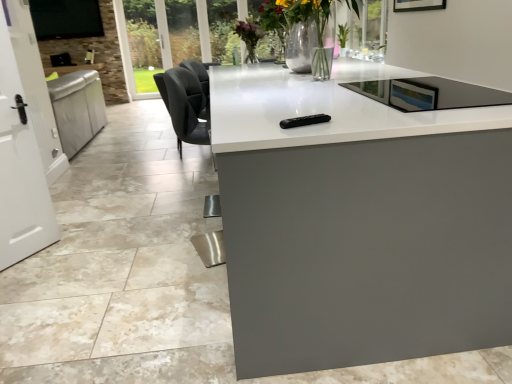
Question: Can you confirm if black glass tv at upper left is thinner than white glossy door at left?

Choices:
 (A) no
 (B) yes

Answer: (A)

Question: From a real-world perspective, is black glass tv at upper left positioned under white glossy door at left based on gravity?

Choices:
 (A) yes
 (B) no

Answer: (B)

Question: Is black glass tv at upper left closer to the viewer compared to white glossy door at left?

Choices:
 (A) no
 (B) yes

Answer: (A)

Question: Does black glass tv at upper left appear on the right side of white glossy door at left?

Choices:
 (A) no
 (B) yes

Answer: (A)

Question: Considering the relative sizes of black glass tv at upper left and white glossy door at left in the image provided, is black glass tv at upper left smaller than white glossy door at left?

Choices:
 (A) no
 (B) yes

Answer: (A)

Question: Choose the correct answer: Is white glossy countertop at center inside black glass tv at upper left or outside it?

Choices:
 (A) inside
 (B) outside

Answer: (B)

Question: From the image's perspective, is white glossy countertop at center above or below black glass tv at upper left?

Choices:
 (A) above
 (B) below

Answer: (B)

Question: In terms of height, does white glossy countertop at center look taller or shorter compared to black glass tv at upper left?

Choices:
 (A) short
 (B) tall

Answer: (A)

Question: Considering the relative positions of white glossy countertop at center and black glass tv at upper left in the image provided, is white glossy countertop at center to the left or to the right of black glass tv at upper left?

Choices:
 (A) left
 (B) right

Answer: (B)

Question: From the image's perspective, relative to black leather swivel chair at center, is black glass tv at upper left above or below?

Choices:
 (A) below
 (B) above

Answer: (B)

Question: Based on their positions, is black glass tv at upper left located to the left or right of black leather swivel chair at center?

Choices:
 (A) right
 (B) left

Answer: (B)

Question: From a real-world perspective, relative to black leather swivel chair at center, is black glass tv at upper left vertically above or below?

Choices:
 (A) above
 (B) below

Answer: (A)

Question: Is point (80, 11) closer or farther from the camera than point (175, 122)?

Choices:
 (A) farther
 (B) closer

Answer: (A)

Question: Does point (269, 6) appear closer or farther from the camera than point (330, 132)?

Choices:
 (A) closer
 (B) farther

Answer: (B)

Question: Visually, is translucent glass vase at center positioned to the left or to the right of white glossy countertop at center?

Choices:
 (A) left
 (B) right

Answer: (B)